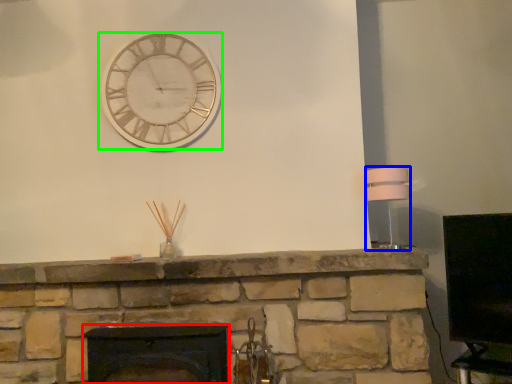
Question: Estimate the real-world distances between objects in this image. Which object is closer to fireplace (highlighted by a red box), lamp (highlighted by a blue box) or wall clock (highlighted by a green box)?

Choices:
 (A) lamp
 (B) wall clock

Answer: (B)